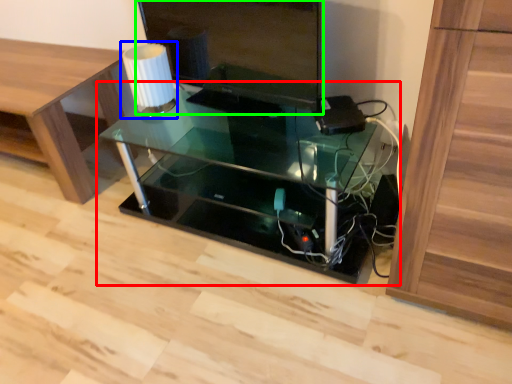
Question: Estimate the real-world distances between objects in this image. Which object is closer to table (highlighted by a red box), table lamp (highlighted by a blue box) or computer monitor (highlighted by a green box)?

Choices:
 (A) table lamp
 (B) computer monitor

Answer: (B)